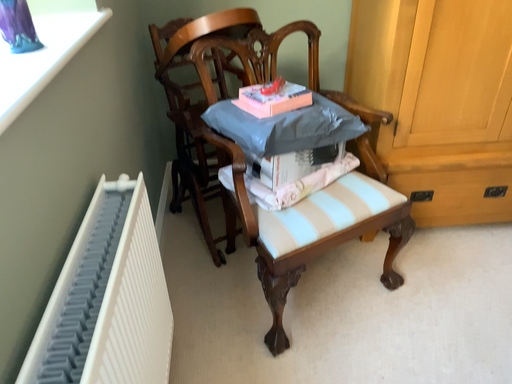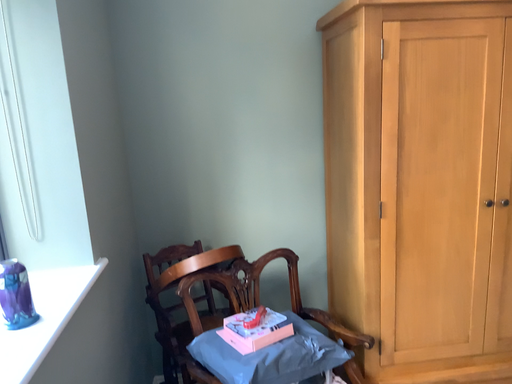
Question: Which way did the camera rotate in the video?

Choices:
 (A) rotated downward
 (B) rotated upward

Answer: (B)